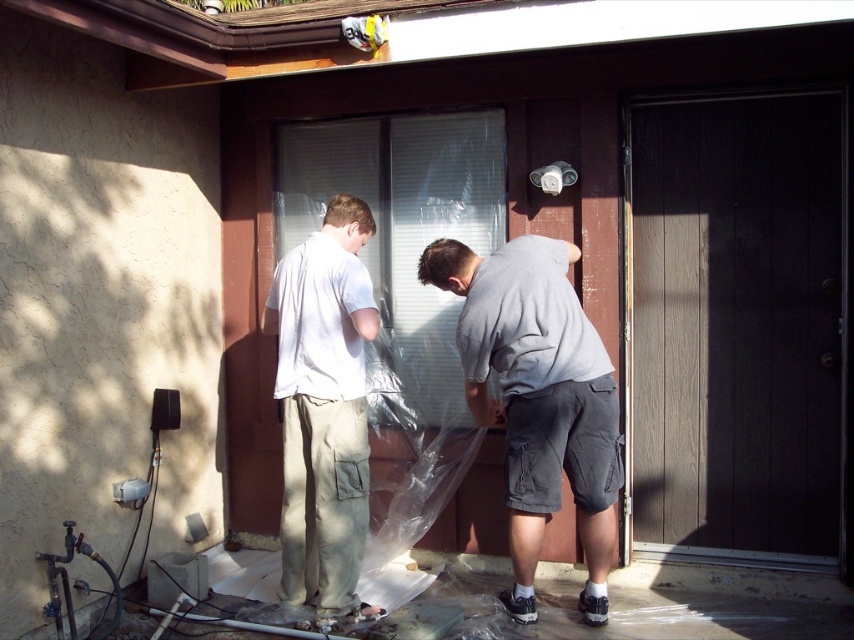
Question: Which object is farther from the camera taking this photo?

Choices:
 (A) dark wood screen door at right
 (B) light beige cargo pants at center
 (C) gray cotton shirt at center

Answer: (A)

Question: Does dark wood screen door at right appear on the right side of transparent plastic at center?

Choices:
 (A) no
 (B) yes

Answer: (B)

Question: Can you confirm if transparent plastic at center is positioned to the right of light beige cargo pants at center?

Choices:
 (A) yes
 (B) no

Answer: (A)

Question: Considering the real-world distances, which object is farthest from the transparent plastic at center?

Choices:
 (A) gray cotton shirt at center
 (B) light beige cargo pants at center

Answer: (A)

Question: Which point is closer to the camera?

Choices:
 (A) dark wood screen door at right
 (B) transparent plastic at center
 (C) light beige cargo pants at center
 (D) gray cotton shirt at center

Answer: (D)

Question: Is dark wood screen door at right bigger than light beige cargo pants at center?

Choices:
 (A) no
 (B) yes

Answer: (B)